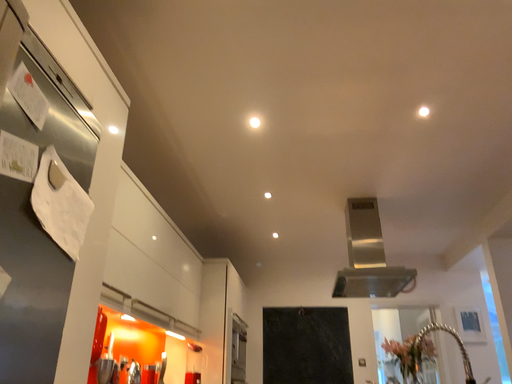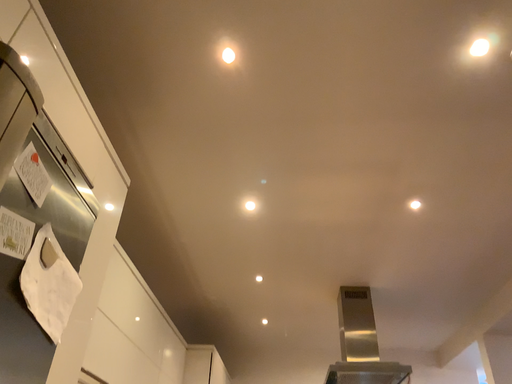
Question: How did the camera likely rotate when shooting the video?

Choices:
 (A) rotated upward
 (B) rotated downward

Answer: (A)